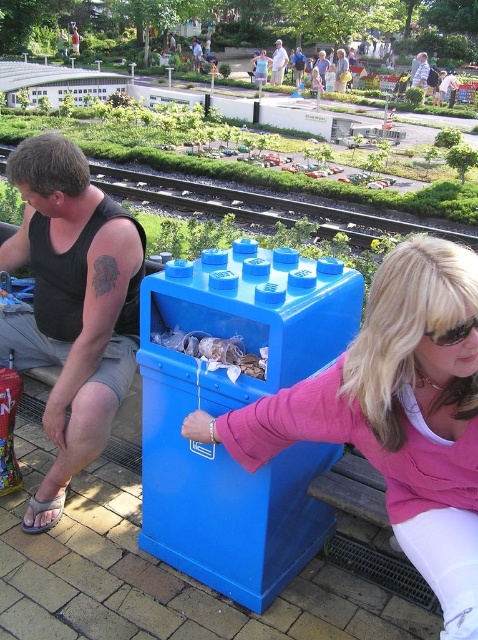
You are a maintenance worker at the park. You need to place a new sign that requires a surface at least 1.2 meters tall. Which object between the blue plastic trash can at center and the light brown wooden bench at center would be suitable for mounting the sign?

The light brown wooden bench at center is taller than the blue plastic trash can at center, so the bench would be suitable for mounting the sign as it meets the height requirement of at least 1.2 meters.